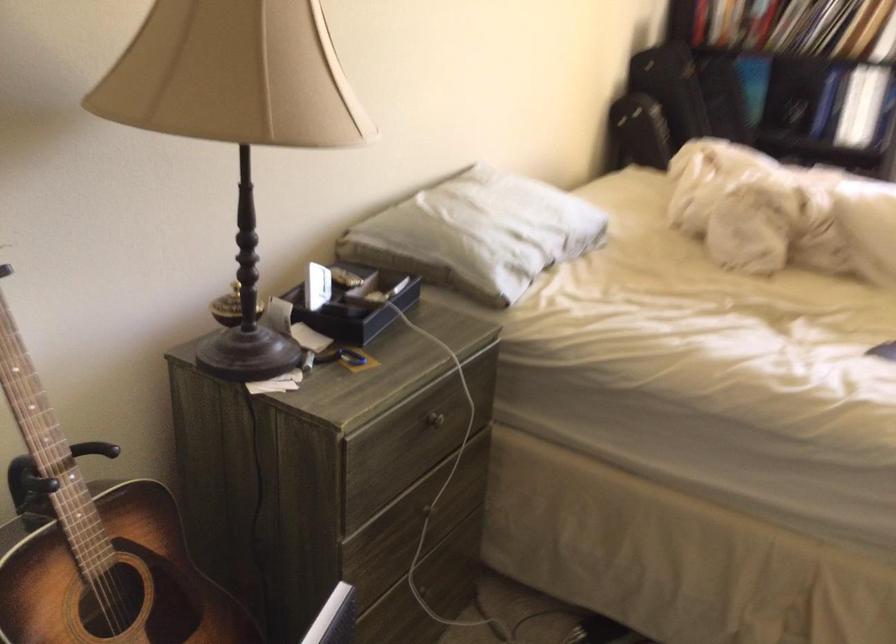
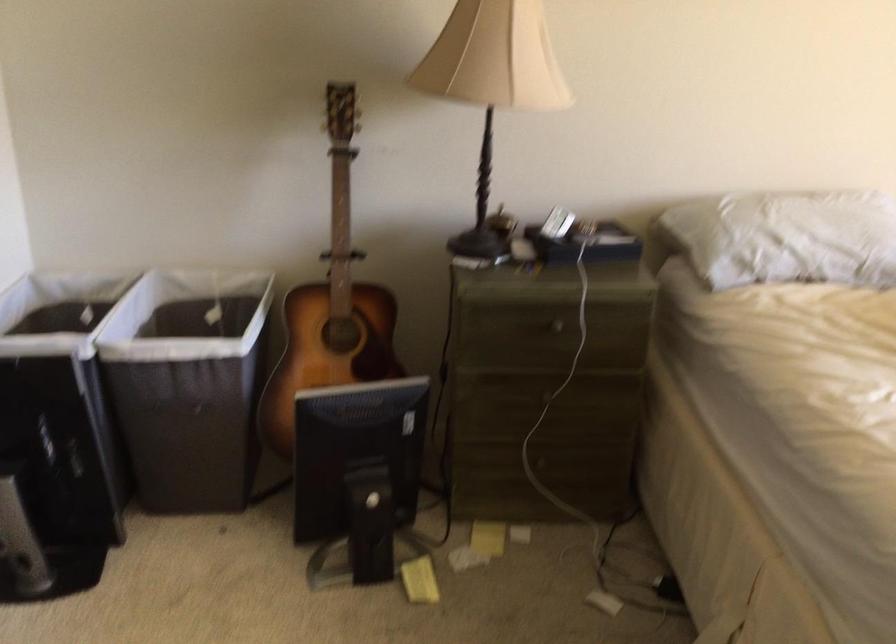
Find the pixel in the second image that matches point (73, 560) in the first image.

(331, 303)